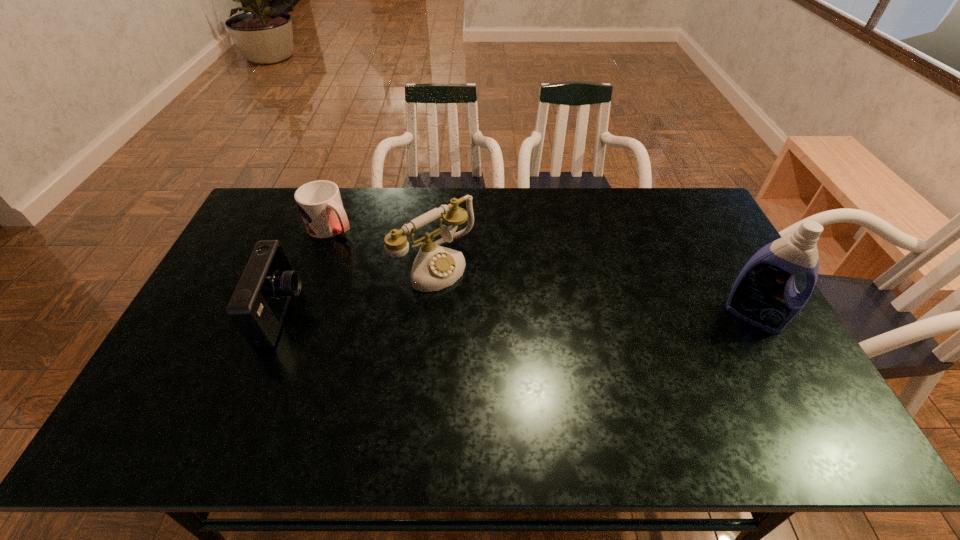
This screenshot has width=960, height=540. In the image, there is a desktop. Find the location of `vacant space at the far left corner`. vacant space at the far left corner is located at coordinates (271, 197).

This screenshot has height=540, width=960. I want to click on free space at the near left corner, so click(x=203, y=396).

The image size is (960, 540). I want to click on vacant area between the third object from left to right and the second shortest object, so click(359, 288).

Where is `vacant area that lies between the third tallest object and the second object from right to left`? This screenshot has height=540, width=960. vacant area that lies between the third tallest object and the second object from right to left is located at coordinates (359, 288).

What are the coordinates of `free space between the second tallest object and the detergent` in the screenshot? It's located at (594, 289).

I want to click on empty space that is in between the mug and the second shortest object, so click(307, 270).

Where is `empty space between the second shortest object and the mug`? The height and width of the screenshot is (540, 960). empty space between the second shortest object and the mug is located at coordinates (307, 270).

You are a GUI agent. You are given a task and a screenshot of the screen. Output one action in this format:
    pyautogui.click(x=<x>, y=<y>)
    Task: Click on the free area in between the rightmost object and the second tallest object
    Image resolution: width=960 pixels, height=540 pixels.
    Given the screenshot: What is the action you would take?
    pyautogui.click(x=594, y=289)

Where is `free area in between the second shortest object and the third shortest object`? free area in between the second shortest object and the third shortest object is located at coordinates (359, 288).

At what (x,y) coordinates should I click in order to perform the action: click on blank region between the rightmost object and the third object from left to right. Please return your answer as a coordinate pair (x, y). Image resolution: width=960 pixels, height=540 pixels. Looking at the image, I should click on (594, 289).